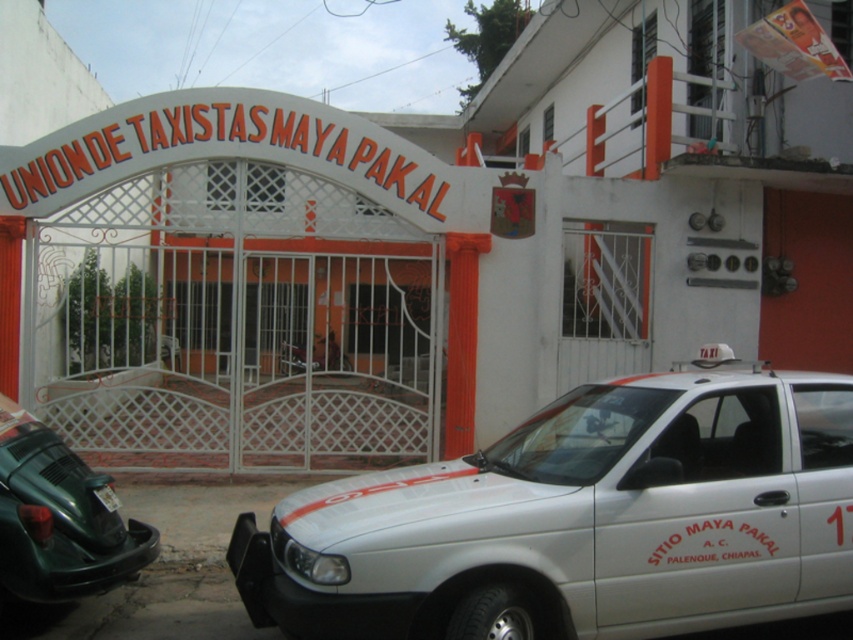
You are a delivery person trying to enter the Union de Taxistas Maya Pakal building. The entrance has a gate with a geometric pattern. There is a white glossy taxi at center. Can you drive through the entrance gate without hitting the taxi?

The white glossy taxi at center is positioned at point (x=581, y=520), which is near the entrance gate. Since the taxi is blocking the entrance, you cannot drive through the entrance gate without hitting the taxi.

You are a visitor arriving at the entrance of Union de Taxistas Maya Pakal. You see a white glossy taxi at center and a green matte car at lower left. Which car is nearer to you as you stand at the entrance?

The white glossy taxi at center is closer to the viewer than the green matte car at lower left, so the white glossy taxi at center is nearer to you as you stand at the entrance.